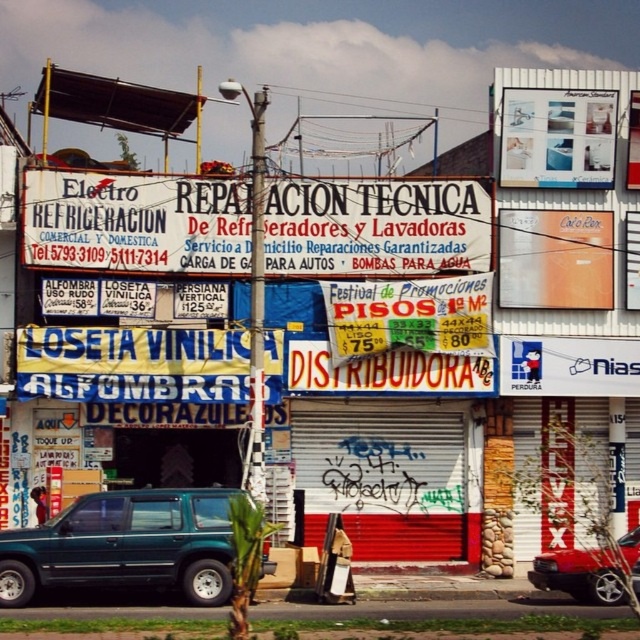
Does white paper sign at center appear on the right side of red glossy car at center?

No, white paper sign at center is not to the right of red glossy car at center.

Is white paper sign at center taller than red glossy car at center?

In fact, white paper sign at center may be shorter than red glossy car at center.

You are a GUI agent. You are given a task and a screenshot of the screen. Output one action in this format:
    pyautogui.click(x=<x>, y=<y>)
    Task: Click on the white paper sign at center
    This screenshot has height=640, width=640.
    Given the screenshot: What is the action you would take?
    pyautogui.click(x=136, y=221)

Does white paper sign at center appear under green matte suv at lower left?

Actually, white paper sign at center is above green matte suv at lower left.

Who is more forward, (355,260) or (154,522)?

Point (154,522)

In order to click on white paper sign at center in this screenshot , I will do `click(136, 221)`.

Does green matte suv at lower left have a lesser height compared to red glossy car at center?

In fact, green matte suv at lower left may be taller than red glossy car at center.

Which is more to the right, green matte suv at lower left or red glossy car at center?

Positioned to the right is red glossy car at center.

Describe the element at coordinates (125, 545) in the screenshot. The height and width of the screenshot is (640, 640). I see `green matte suv at lower left` at that location.

Identify the location of green matte suv at lower left. (125, 545).